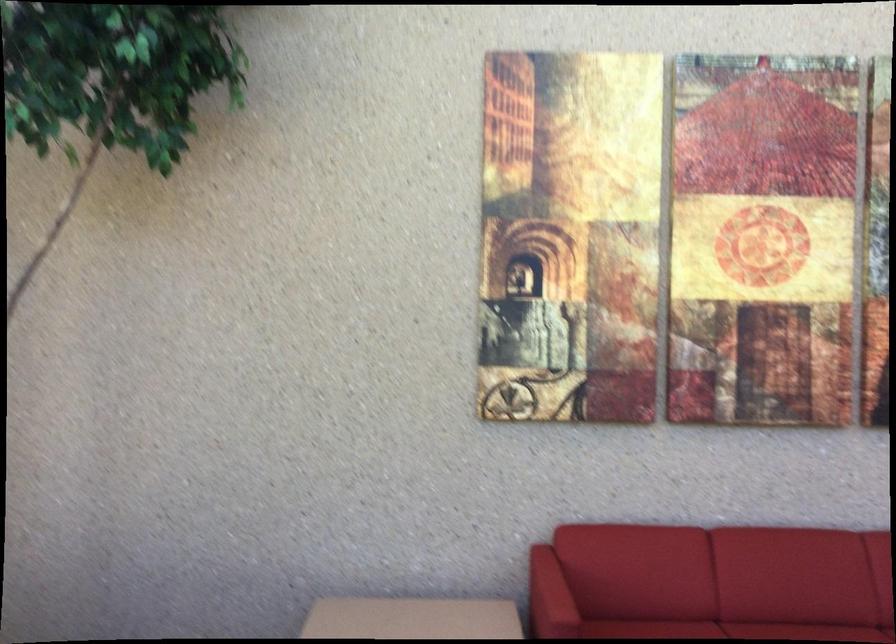
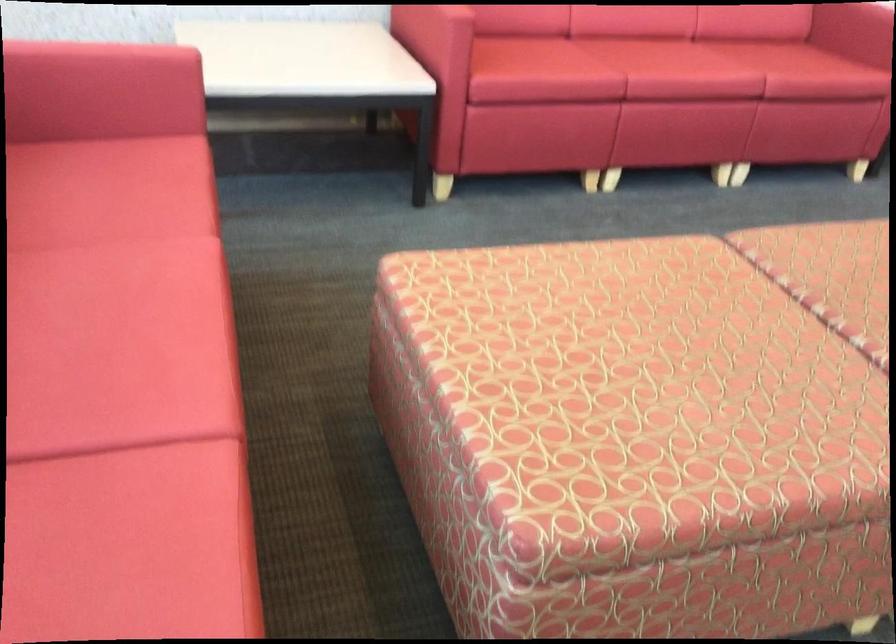
First-person continuous shooting, in which direction is the camera rotating?

The rotation direction of the camera is right-down.